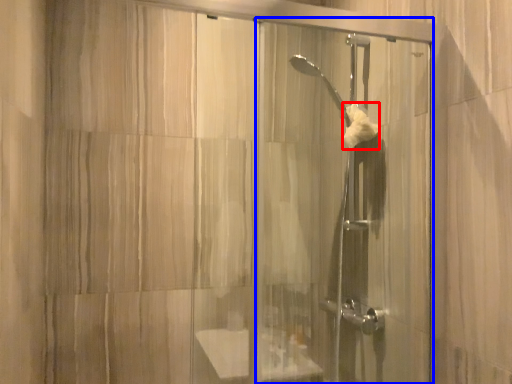
Question: Which object appears farthest to the camera in this image, hand towel (highlighted by a red box) or screen door (highlighted by a blue box)?

Choices:
 (A) hand towel
 (B) screen door

Answer: (A)